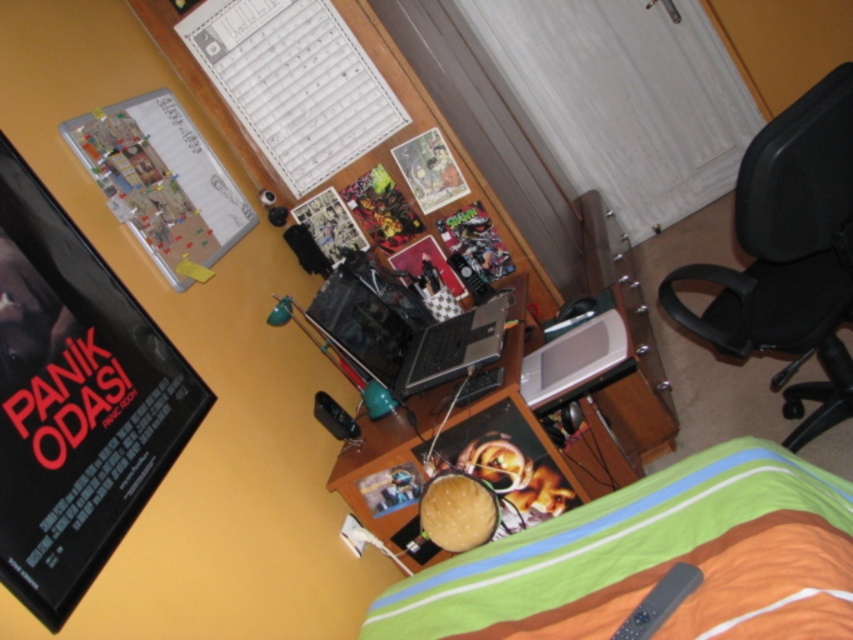
In the scene shown: Between black plastic swivel chair at right and shiny black laptop at center, which one is positioned lower?

shiny black laptop at center is lower down.

From the picture: Is black plastic swivel chair at right behind shiny black laptop at center?

No, black plastic swivel chair at right is closer to the viewer.

The height and width of the screenshot is (640, 853). Find the location of `black plastic swivel chair at right`. black plastic swivel chair at right is located at coordinates (788, 253).

How far apart are green striped fabric bed at lower right and shiny black laptop at center?

green striped fabric bed at lower right and shiny black laptop at center are 26.85 inches apart.

The image size is (853, 640). I want to click on green striped fabric bed at lower right, so click(654, 560).

Image resolution: width=853 pixels, height=640 pixels. In order to click on green striped fabric bed at lower right in this screenshot , I will do `click(654, 560)`.

Is point (798, 536) positioned after point (527, 502)?

No, it is not.

Is green striped fabric bed at lower right wider than metallic silver laptop at center?

Yes, green striped fabric bed at lower right is wider than metallic silver laptop at center.

What do you see at coordinates (654, 560) in the screenshot? This screenshot has width=853, height=640. I see `green striped fabric bed at lower right` at bounding box center [654, 560].

Image resolution: width=853 pixels, height=640 pixels. Find the location of `green striped fabric bed at lower right`. green striped fabric bed at lower right is located at coordinates (654, 560).